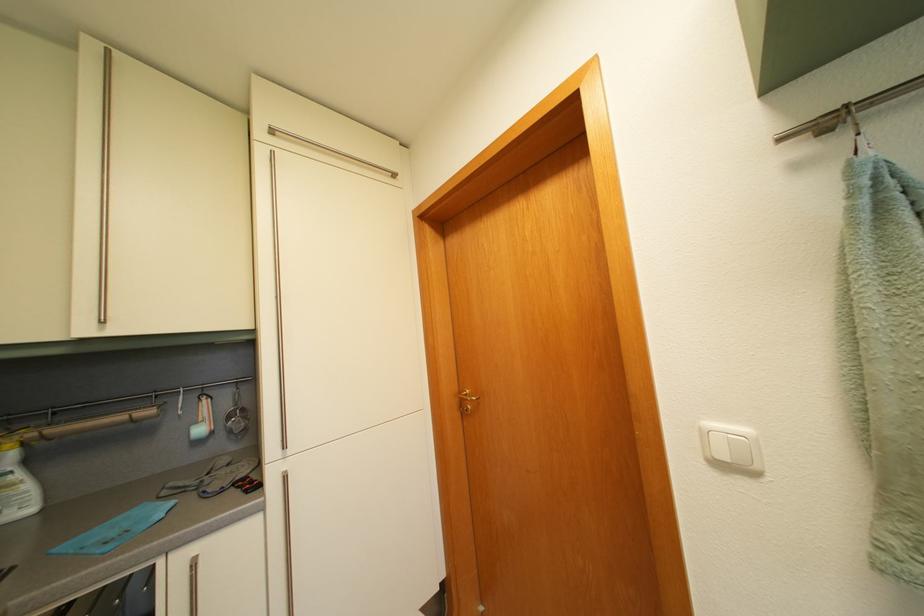
Where is `white light switch`? This screenshot has width=924, height=616. white light switch is located at coordinates (732, 447).